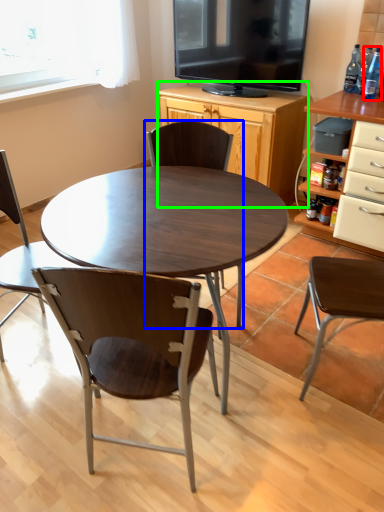
Question: Which object is positioned closest to bottle (highlighted by a red box)? Select from chair (highlighted by a blue box) and cabinetry (highlighted by a green box).

Choices:
 (A) chair
 (B) cabinetry

Answer: (B)